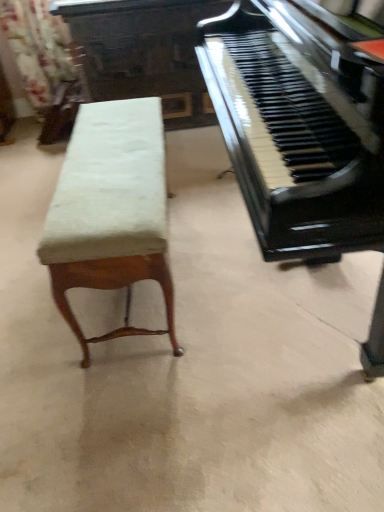
Locate an element on the screen. vacant space to the right of velvet upholstered bench at left is located at coordinates (244, 273).